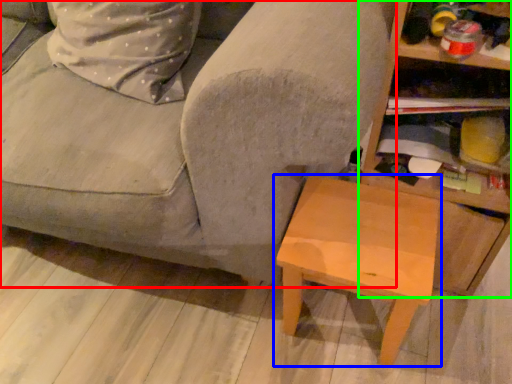
Question: Considering the real-world distances, which object is farthest from studio couch (highlighted by a red box)? table (highlighted by a blue box) or shelf (highlighted by a green box)?

Choices:
 (A) table
 (B) shelf

Answer: (B)